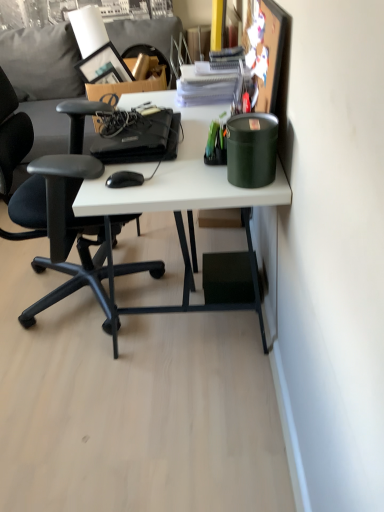
Image resolution: width=384 pixels, height=512 pixels. In order to click on free space to the left of black plastic mouse at center in this screenshot , I will do `click(97, 183)`.